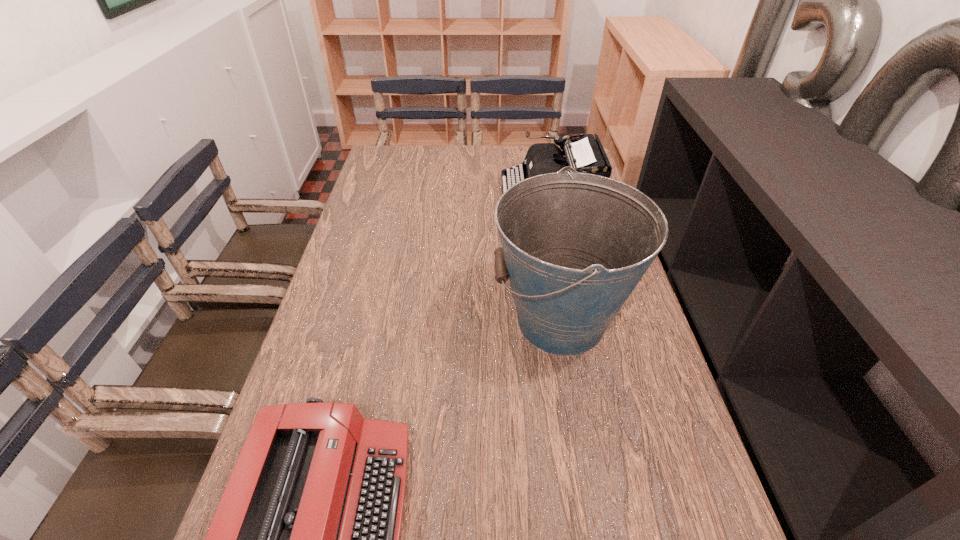
The width and height of the screenshot is (960, 540). In order to click on bucket in this screenshot , I will do `click(574, 246)`.

Where is `the tallest object`? This screenshot has height=540, width=960. the tallest object is located at coordinates (574, 246).

At what (x,y) coordinates should I click in order to perform the action: click on the farther typewriter. Please return your answer as a coordinate pair (x, y). Image resolution: width=960 pixels, height=540 pixels. Looking at the image, I should click on (585, 154).

Where is `the second shortest object`? the second shortest object is located at coordinates (585, 154).

The width and height of the screenshot is (960, 540). I want to click on blank space located 0.050m with the handle on opposite sides of the tallest object, so click(471, 321).

Locate an element on the screen. vacant space located 0.260m with the handle on opposite sides of the tallest object is located at coordinates (387, 321).

Image resolution: width=960 pixels, height=540 pixels. I want to click on vacant space situated 0.330m with the handle on opposite sides of the tallest object, so click(358, 321).

In order to click on vacant position located on the typing side of the taller typewriter in this screenshot , I will do pyautogui.click(x=429, y=192).

This screenshot has width=960, height=540. Identify the location of free space located on the typing side of the taller typewriter. (462, 192).

Identify the location of vacant space located on the typing side of the taller typewriter. (386, 192).